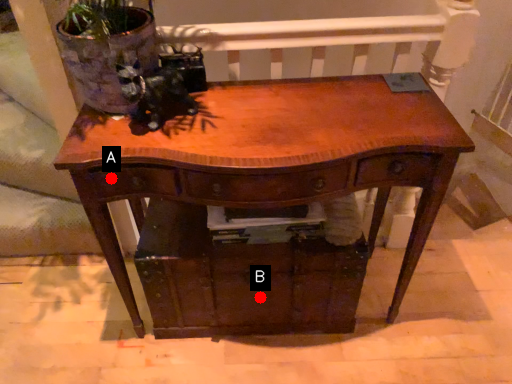
Question: Two points are circled on the image, labeled by A and B beside each circle. Which of the following is the closest to the observer?

Choices:
 (A) A is closer
 (B) B is closer

Answer: (A)